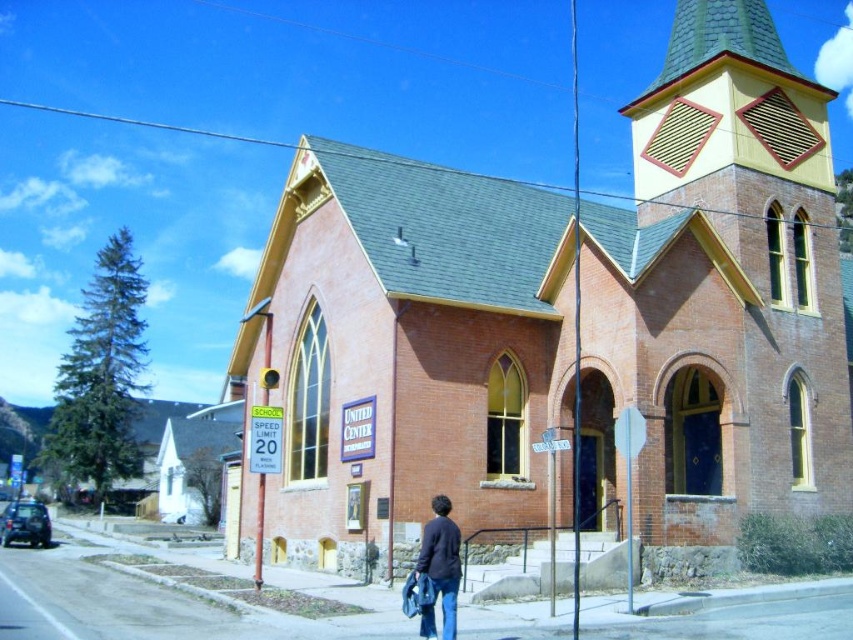
You are standing in front of the church and see two points marked on the image. The first point is at coordinate point(809, 480) and the second is at point(430, 611). If you want to touch both points with your finger, which point should you reach for first?

You should reach for point(430, 611) first because it is closer to you than point(809, 480), which is further away.

You are standing in front of the red brick church at center and the dark blue sweater at lower center. Which object is positioned to the left?

The dark blue sweater at lower center is positioned to the left of the red brick church at center.

You are standing at the entrance of the red brick church at center and looking towards the dark blue sweater at lower center. Which object is closer to your eyes?

The dark blue sweater at lower center is closer to your eyes because it is positioned at lower center, which is typically closer to the observer in such scenes.